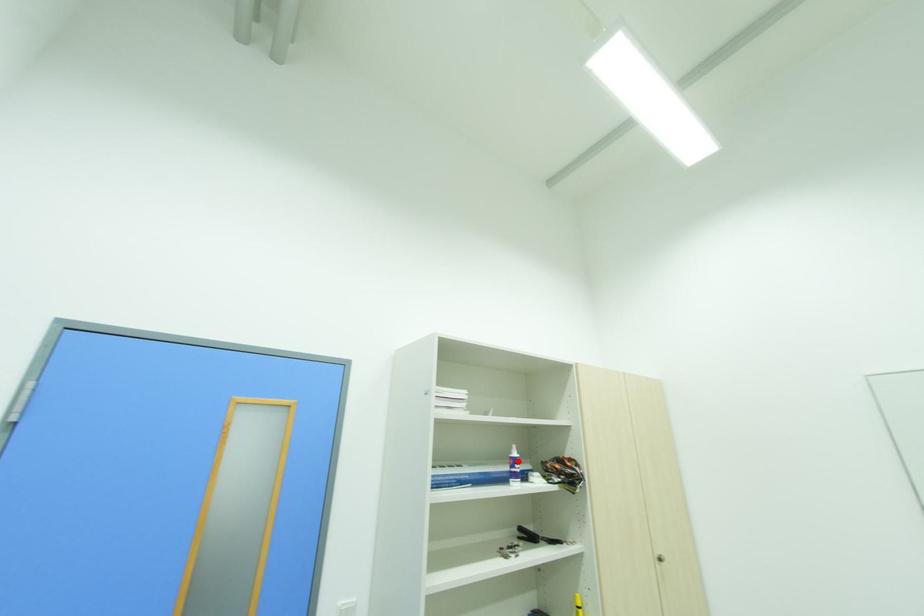
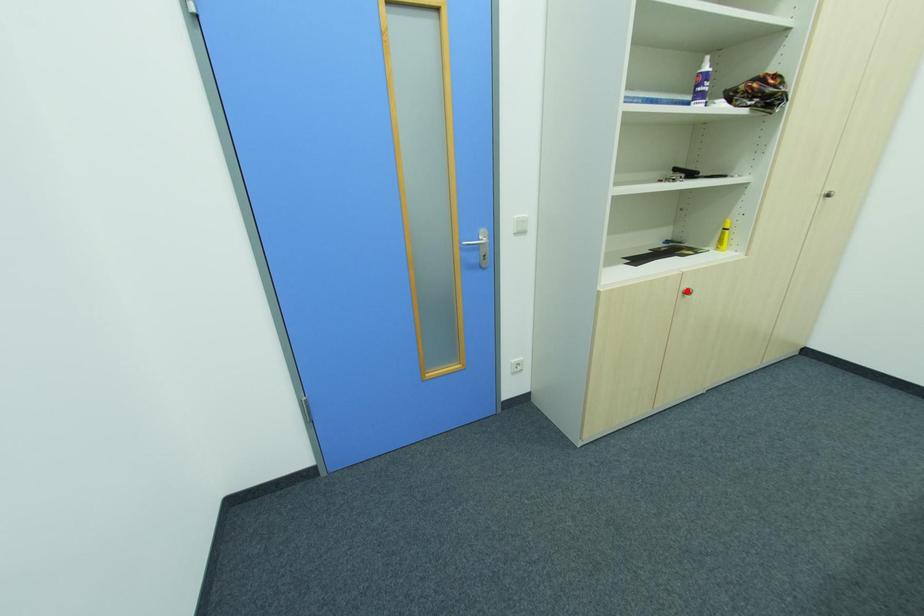
I am providing you with two images of the same scene from different viewpoints. A red point is marked on the first image and another point is marked on the second image. Are the points marked in image1 and image2 representing the same 3D position?

No